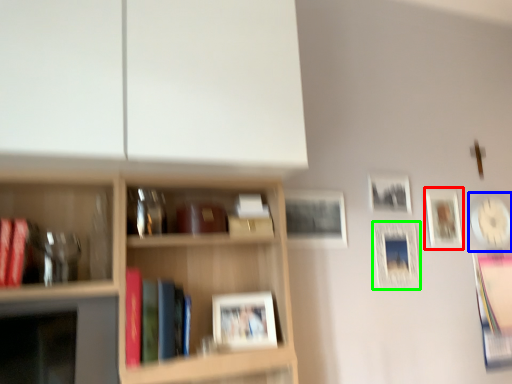
Question: Which is nearer to the picture frame (highlighted by a red box)? picture frame (highlighted by a blue box) or picture frame (highlighted by a green box).

Choices:
 (A) picture frame
 (B) picture frame

Answer: (A)